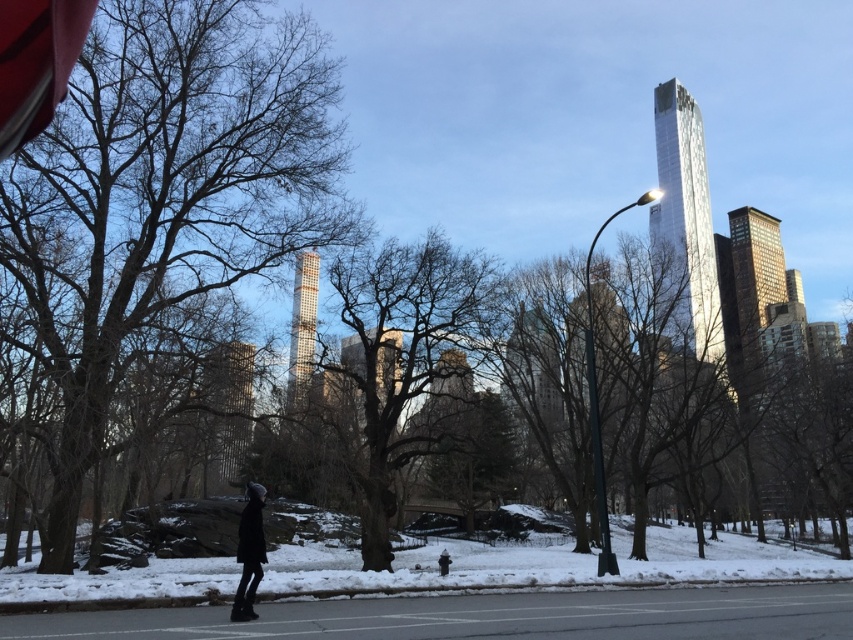
Is smooth brown tree at center wider than black matte coat at center?

Correct, the width of smooth brown tree at center exceeds that of black matte coat at center.

Where is `smooth brown tree at center`? Image resolution: width=853 pixels, height=640 pixels. smooth brown tree at center is located at coordinates (403, 360).

Find the location of `smooth brown tree at center`. smooth brown tree at center is located at coordinates (403, 360).

Is smooth brown tree at left thinner than smooth brown tree at center?

In fact, smooth brown tree at left might be wider than smooth brown tree at center.

Does point (209, 70) come behind point (367, 420)?

No, (209, 70) is in front of (367, 420).

Does point (113, 362) lie behind point (447, 291)?

No, (113, 362) is in front of (447, 291).

The width and height of the screenshot is (853, 640). I want to click on smooth brown tree at left, so click(x=163, y=193).

How much distance is there between smooth brown tree at left and black matte coat at center?

A distance of 9.86 meters exists between smooth brown tree at left and black matte coat at center.

Can you confirm if smooth brown tree at left is taller than black matte coat at center?

Yes, smooth brown tree at left is taller than black matte coat at center.

Who is more forward, (73, 145) or (445, 568)?

Point (445, 568) is in front.

Locate an element on the screen. Image resolution: width=853 pixels, height=640 pixels. smooth brown tree at left is located at coordinates (163, 193).